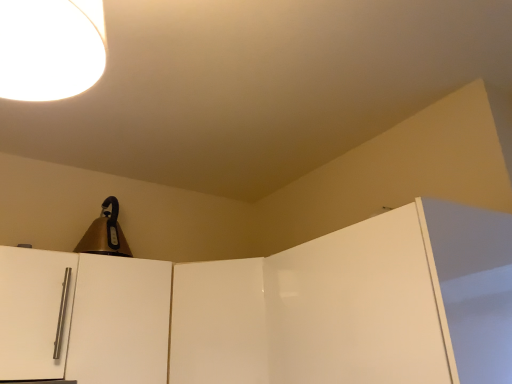
What do you see at coordinates (355, 307) in the screenshot? I see `glossy white door at upper right, the first door in the right-to-left sequence` at bounding box center [355, 307].

Where is `glossy white door at center, which appears as the second door when viewed from the right`? The width and height of the screenshot is (512, 384). glossy white door at center, which appears as the second door when viewed from the right is located at coordinates (218, 323).

What do you see at coordinates (50, 48) in the screenshot? I see `white glossy lampshade at upper left` at bounding box center [50, 48].

What do you see at coordinates (35, 312) in the screenshot?
I see `satin white door handle at left, placed as the fourth door when sorted from right to left` at bounding box center [35, 312].

The image size is (512, 384). I want to click on gold metallic bell at upper left, so click(x=105, y=233).

From the image's perspective, between glossy white door at center, the 3th door in the left-to-right sequence, and satin white door handle at left, placed as the fourth door when sorted from right to left, which one is located above?

satin white door handle at left, placed as the fourth door when sorted from right to left, from the image's perspective.

Starting from the satin white door handle at left, placed as the fourth door when sorted from right to left, which door is the 2nd one behind? Please provide its 2D coordinates.

[(218, 323)]

In terms of height, does glossy white door at center, which appears as the second door when viewed from the right, look taller or shorter compared to satin white door handle at left, placed as the first door when sorted from left to right?

glossy white door at center, which appears as the second door when viewed from the right, is taller than satin white door handle at left, placed as the first door when sorted from left to right.

Is glossy white door at center, the 3th door in the left-to-right sequence, located outside satin white door handle at left, placed as the first door when sorted from left to right?

Yes.

Locate an element on the screen. door that is the 2nd object above the glossy white door at center, which appears as the second door when viewed from the right (from a real-world perspective) is located at coordinates (120, 321).

How much distance is there between white glossy cabinet door at left, which is the second door from left to right, and glossy white door at center, the 3th door in the left-to-right sequence?

6.25 inches.

Based on the photo, is white glossy cabinet door at left, which is the second door from left to right, thinner than glossy white door at center, which appears as the second door when viewed from the right?

Yes.

Is point (134, 284) farther from viewer compared to point (223, 279)?

No, it is in front of (223, 279).

Which object is positioned more to the right, white glossy lampshade at upper left or white glossy cabinet door at left, the 3th door from the right?

white glossy lampshade at upper left is more to the right.

From a real-world perspective, which is physically above, white glossy lampshade at upper left or white glossy cabinet door at left, the 3th door from the right?

white glossy lampshade at upper left, from a real-world perspective.

From the picture: Choose the correct answer: Is white glossy lampshade at upper left inside white glossy cabinet door at left, which is the second door from left to right, or outside it?

white glossy lampshade at upper left is not enclosed by white glossy cabinet door at left, which is the second door from left to right.

Considering the relative sizes of white glossy lampshade at upper left and white glossy cabinet door at left, which is the second door from left to right, in the image provided, is white glossy lampshade at upper left smaller than white glossy cabinet door at left, which is the second door from left to right,?

Indeed, white glossy lampshade at upper left has a smaller size compared to white glossy cabinet door at left, which is the second door from left to right.

Could you tell me if gold metallic bell at upper left is facing glossy white door at upper right, the fourth door from the left?

No.

From the image's perspective, which is below, gold metallic bell at upper left or glossy white door at upper right, the fourth door from the left?

glossy white door at upper right, the fourth door from the left.

From their relative heights in the image, would you say gold metallic bell at upper left is taller or shorter than glossy white door at upper right, the first door in the right-to-left sequence?

gold metallic bell at upper left is shorter than glossy white door at upper right, the first door in the right-to-left sequence.

Can you confirm if gold metallic bell at upper left is wider than glossy white door at upper right, the first door in the right-to-left sequence?

No, gold metallic bell at upper left is not wider than glossy white door at upper right, the first door in the right-to-left sequence.

You are a GUI agent. You are given a task and a screenshot of the screen. Output one action in this format:
    pyautogui.click(x=<x>, y=<y>)
    Task: Click on the 1st door located beneath the gold metallic bell at upper left (from a real-world perspective)
    
    Given the screenshot: What is the action you would take?
    pyautogui.click(x=35, y=312)

From a real-world perspective, is satin white door handle at left, placed as the first door when sorted from left to right, below gold metallic bell at upper left?

Indeed, from a real-world perspective, satin white door handle at left, placed as the first door when sorted from left to right, is positioned beneath gold metallic bell at upper left.

Would you say satin white door handle at left, placed as the fourth door when sorted from right to left, is inside or outside gold metallic bell at upper left?

satin white door handle at left, placed as the fourth door when sorted from right to left, is located beyond the bounds of gold metallic bell at upper left.

In terms of width, does satin white door handle at left, placed as the first door when sorted from left to right, look wider or thinner when compared to gold metallic bell at upper left?

In the image, satin white door handle at left, placed as the first door when sorted from left to right, appears to be wider than gold metallic bell at upper left.

How many degrees apart are the facing directions of white glossy lampshade at upper left and glossy white door at upper right, the first door in the right-to-left sequence?

2.47 degrees.

From a real-world perspective, is white glossy lampshade at upper left positioned above or below glossy white door at upper right, the first door in the right-to-left sequence?

white glossy lampshade at upper left is above glossy white door at upper right, the first door in the right-to-left sequence.

Is white glossy lampshade at upper left directly adjacent to glossy white door at upper right, the first door in the right-to-left sequence?

white glossy lampshade at upper left and glossy white door at upper right, the first door in the right-to-left sequence, are clearly separated.

Between white glossy lampshade at upper left and glossy white door at upper right, the first door in the right-to-left sequence, which one is positioned in front?

white glossy lampshade at upper left is more forward.

Is gold metallic bell at upper left outside of satin white door handle at left, placed as the first door when sorted from left to right?

Yes, gold metallic bell at upper left is outside of satin white door handle at left, placed as the first door when sorted from left to right.

Who is taller, gold metallic bell at upper left or satin white door handle at left, placed as the first door when sorted from left to right?

With more height is satin white door handle at left, placed as the first door when sorted from left to right.

Looking at this image, from the image's perspective, would you say gold metallic bell at upper left is positioned over satin white door handle at left, placed as the first door when sorted from left to right?

Yes, from the image's perspective, gold metallic bell at upper left is above satin white door handle at left, placed as the first door when sorted from left to right.

Can you confirm if gold metallic bell at upper left is bigger than satin white door handle at left, placed as the first door when sorted from left to right?

Incorrect, gold metallic bell at upper left is not larger than satin white door handle at left, placed as the first door when sorted from left to right.

Locate an element on the screen. Image resolution: width=512 pixels, height=384 pixels. the 2nd door behind the satin white door handle at left, placed as the fourth door when sorted from right to left is located at coordinates (218, 323).

Where is `door located below the white glossy cabinet door at left, the 3th door from the right (from the image's perspective)`? door located below the white glossy cabinet door at left, the 3th door from the right (from the image's perspective) is located at coordinates (218, 323).

Looking at the image, which one is located closer to glossy white door at upper right, the fourth door from the left, glossy white door at center, the 3th door in the left-to-right sequence, or gold metallic bell at upper left?

Among the two, glossy white door at center, the 3th door in the left-to-right sequence, is located nearer to glossy white door at upper right, the fourth door from the left.

From the image, which object appears to be nearer to glossy white door at upper right, the fourth door from the left, white glossy cabinet door at left, the 3th door from the right, or gold metallic bell at upper left?

white glossy cabinet door at left, the 3th door from the right, is closer to glossy white door at upper right, the fourth door from the left.

Considering their positions, is satin white door handle at left, placed as the fourth door when sorted from right to left, positioned closer to gold metallic bell at upper left than glossy white door at upper right, the first door in the right-to-left sequence?

satin white door handle at left, placed as the fourth door when sorted from right to left, is positioned closer to the anchor gold metallic bell at upper left.

From the picture: Which object lies nearer to the anchor point glossy white door at center, which appears as the second door when viewed from the right, white glossy cabinet door at left, the 3th door from the right, or gold metallic bell at upper left?

white glossy cabinet door at left, the 3th door from the right.

Estimate the real-world distances between objects in this image. Which object is closer to white glossy lampshade at upper left, glossy white door at upper right, the fourth door from the left, or glossy white door at center, the 3th door in the left-to-right sequence?

Among the two, glossy white door at upper right, the fourth door from the left, is located nearer to white glossy lampshade at upper left.

Based on their spatial positions, is glossy white door at center, which appears as the second door when viewed from the right, or white glossy lampshade at upper left further from glossy white door at upper right, the fourth door from the left?

Based on the image, white glossy lampshade at upper left appears to be further to glossy white door at upper right, the fourth door from the left.

Based on the photo, looking at the image, which one is located closer to white glossy cabinet door at left, which is the second door from left to right, gold metallic bell at upper left or satin white door handle at left, placed as the fourth door when sorted from right to left?

The object closer to white glossy cabinet door at left, which is the second door from left to right, is satin white door handle at left, placed as the fourth door when sorted from right to left.

From the image, which object appears to be farther from glossy white door at upper right, the fourth door from the left, white glossy cabinet door at left, the 3th door from the right, or glossy white door at center, which appears as the second door when viewed from the right?

Among the two, white glossy cabinet door at left, the 3th door from the right, is located further to glossy white door at upper right, the fourth door from the left.

In order to click on door between satin white door handle at left, placed as the fourth door when sorted from right to left, and glossy white door at center, the 3th door in the left-to-right sequence in this screenshot , I will do `click(120, 321)`.

The image size is (512, 384). I want to click on door between gold metallic bell at upper left and glossy white door at center, the 3th door in the left-to-right sequence, so click(120, 321).

You are a GUI agent. You are given a task and a screenshot of the screen. Output one action in this format:
    pyautogui.click(x=<x>, y=<y>)
    Task: Click on the lamp between white glossy cabinet door at left, which is the second door from left to right, and glossy white door at upper right, the first door in the right-to-left sequence, in the horizontal direction
    The image size is (512, 384).
    Given the screenshot: What is the action you would take?
    pyautogui.click(x=50, y=48)

The image size is (512, 384). In order to click on appliance located between satin white door handle at left, placed as the first door when sorted from left to right, and glossy white door at upper right, the fourth door from the left, in the left-right direction in this screenshot , I will do `click(105, 233)`.